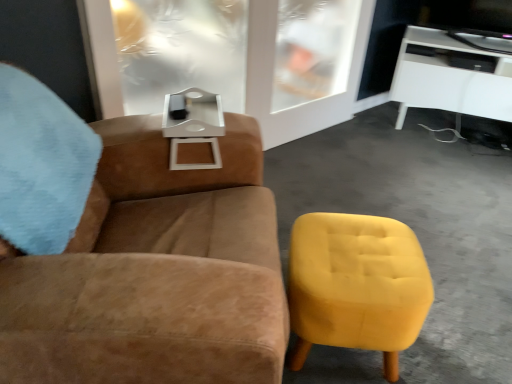
Find the location of a particular element. vacant location below white glossy tv stand at upper right (from a real-world perspective) is located at coordinates (429, 129).